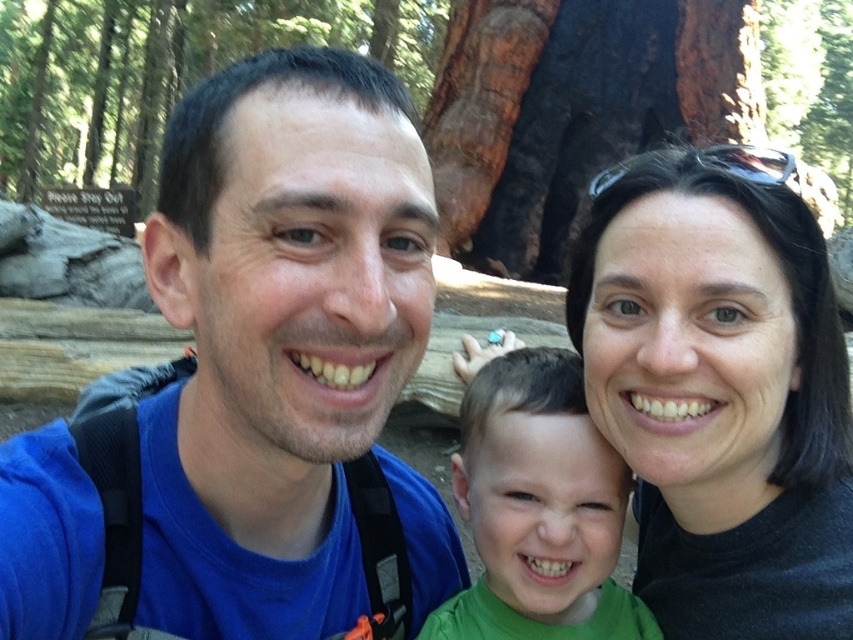
Question: Is black matte hair at upper right thinner than green matte shirt at center?

Choices:
 (A) yes
 (B) no

Answer: (B)

Question: Is blue fabric shirt at center positioned in front of black matte hair at upper right?

Choices:
 (A) no
 (B) yes

Answer: (B)

Question: Which object is closer to the camera taking this photo?

Choices:
 (A) black matte hair at upper right
 (B) green matte shirt at center

Answer: (A)

Question: Which point is farther to the camera?

Choices:
 (A) blue fabric shirt at center
 (B) green matte shirt at center

Answer: (B)

Question: Can you confirm if blue fabric shirt at center is positioned to the right of black matte hair at upper right?

Choices:
 (A) no
 (B) yes

Answer: (A)

Question: Which point is closer to the camera?

Choices:
 (A) (767, 568)
 (B) (392, 252)

Answer: (B)